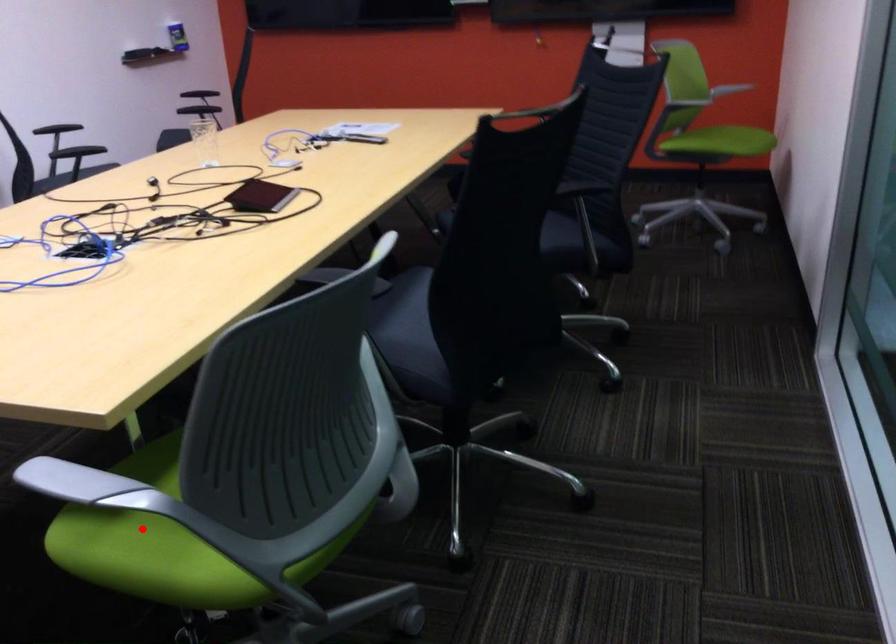
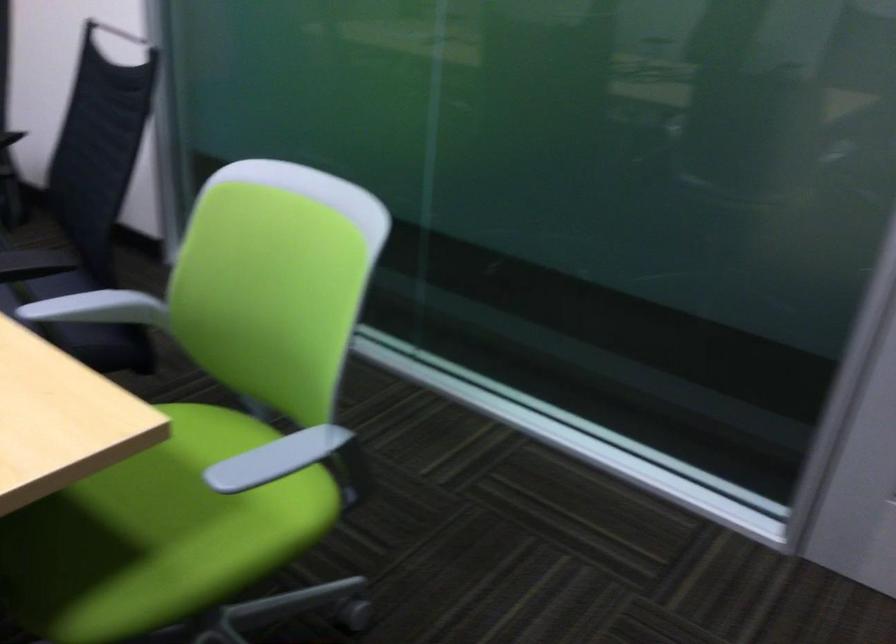
Question: A red point is marked in image1. In image2, is the corresponding 3D point closer to the camera or farther? Reply with the corresponding letter.

Choices:
 (A) The corresponding 3D point is closer.
 (B) The corresponding 3D point is farther.

Answer: (A)